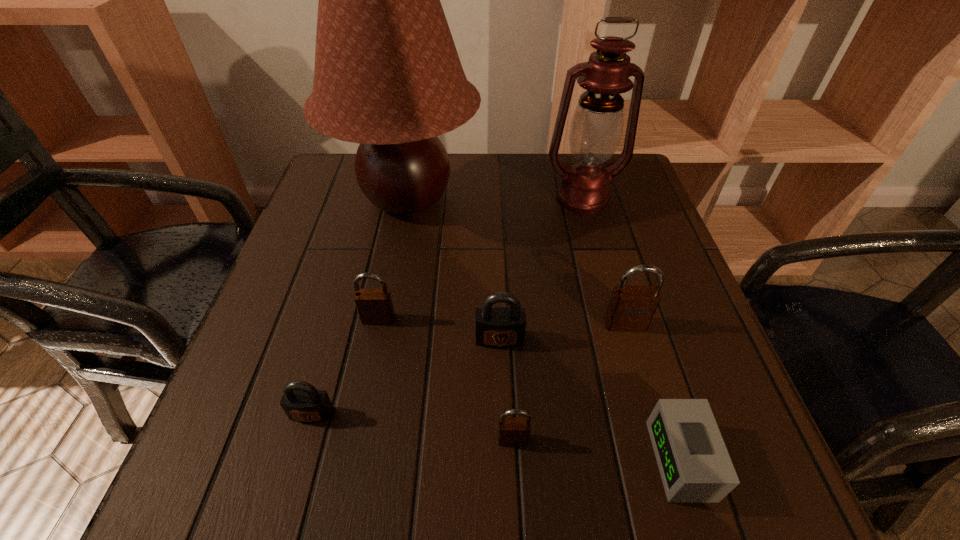
This screenshot has height=540, width=960. In order to click on the second brown padlock from right to left in this screenshot , I will do `click(512, 431)`.

The height and width of the screenshot is (540, 960). I want to click on the nearest padlock, so click(512, 431).

Where is `the shortest object`? Image resolution: width=960 pixels, height=540 pixels. the shortest object is located at coordinates (695, 467).

Find the location of `free location located on the front-facing side of the brown lampshade`. free location located on the front-facing side of the brown lampshade is located at coordinates (392, 282).

At what (x,y) coordinates should I click in order to perform the action: click on vacant space located on the front of the oil lamp. Please return your answer as a coordinate pair (x, y). Looking at the image, I should click on (626, 359).

This screenshot has width=960, height=540. What are the coordinates of `free space located 0.260m on the front-facing side of the sixth shortest object` in the screenshot? It's located at coord(671,481).

This screenshot has height=540, width=960. I want to click on vacant space located 0.220m on the front-facing side of the second biggest brown padlock, so click(x=353, y=442).

Find the location of a particular element. This screenshot has width=960, height=540. vacant space located 0.090m on the front of the farther gray padlock near the keyhole is located at coordinates (502, 396).

Find the location of a particular element. This screenshot has width=960, height=540. vacant space located 0.070m on the front of the smaller gray padlock near the keyhole is located at coordinates (296, 471).

I want to click on free point located on the front-facing side of the nearest brown padlock, so click(x=515, y=481).